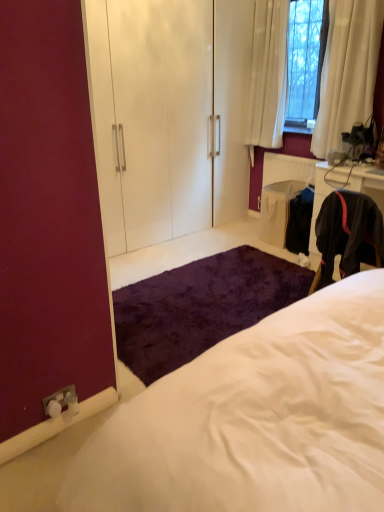
Question: Based on their sizes in the image, would you say white glossy armoire at upper center is bigger or smaller than shaggy purple rug at lower center?

Choices:
 (A) small
 (B) big

Answer: (B)

Question: Considering the positions of white glossy armoire at upper center and shaggy purple rug at lower center in the image, is white glossy armoire at upper center wider or thinner than shaggy purple rug at lower center?

Choices:
 (A) wide
 (B) thin

Answer: (B)

Question: Which object is positioned closest to the shaggy purple rug at lower center?

Choices:
 (A) white fluffy bed at center
 (B) black fabric at right
 (C) white glossy armoire at upper center
 (D) white textured radiator at right

Answer: (B)

Question: Based on their relative distances, which object is nearer to the black fabric at right?

Choices:
 (A) white fluffy bed at center
 (B) white glossy armoire at upper center
 (C) shaggy purple rug at lower center
 (D) white textured radiator at right

Answer: (D)